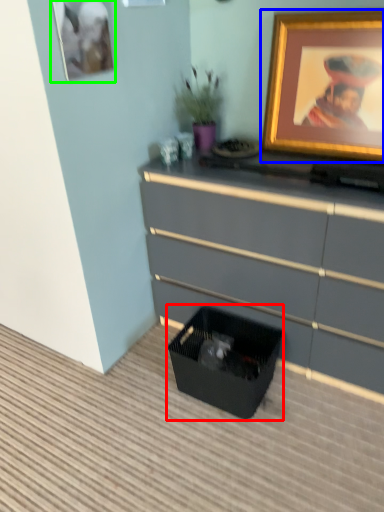
Question: Considering the real-world distances, which object is closest to storage box (highlighted by a red box)? picture frame (highlighted by a blue box) or picture frame (highlighted by a green box).

Choices:
 (A) picture frame
 (B) picture frame

Answer: (A)